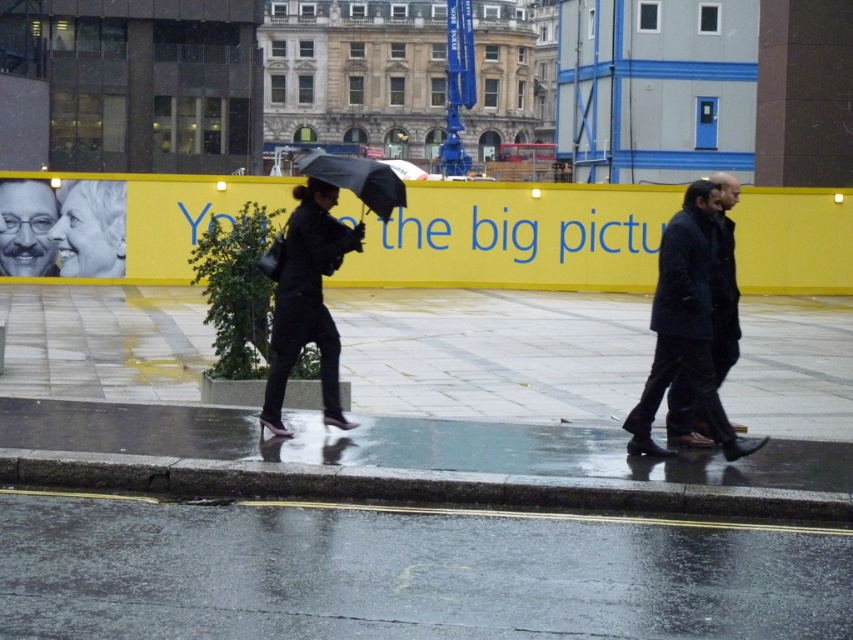
Question: Is matte black portrait at upper left to the right of dark blue jacket at center from the viewer's perspective?

Choices:
 (A) yes
 (B) no

Answer: (B)

Question: Which of the following is the closest to the observer?

Choices:
 (A) matte black glasses at upper left
 (B) dark blue jacket at center
 (C) shiny asphalt road at lower center
 (D) transparent plastic umbrella at center

Answer: (C)

Question: Does matte black glasses at upper left lie behind transparent plastic umbrella at center?

Choices:
 (A) no
 (B) yes

Answer: (B)

Question: Which point is farther to the camera?

Choices:
 (A) matte black glasses at upper left
 (B) dark blue jacket at center

Answer: (A)

Question: Does dark blue coat at center have a larger size compared to matte black glasses at upper left?

Choices:
 (A) yes
 (B) no

Answer: (B)

Question: Which is nearer to the matte black glasses at upper left?

Choices:
 (A) shiny asphalt road at lower center
 (B) dark blue jacket at center
 (C) matte black portrait at upper left
 (D) transparent plastic umbrella at center

Answer: (C)